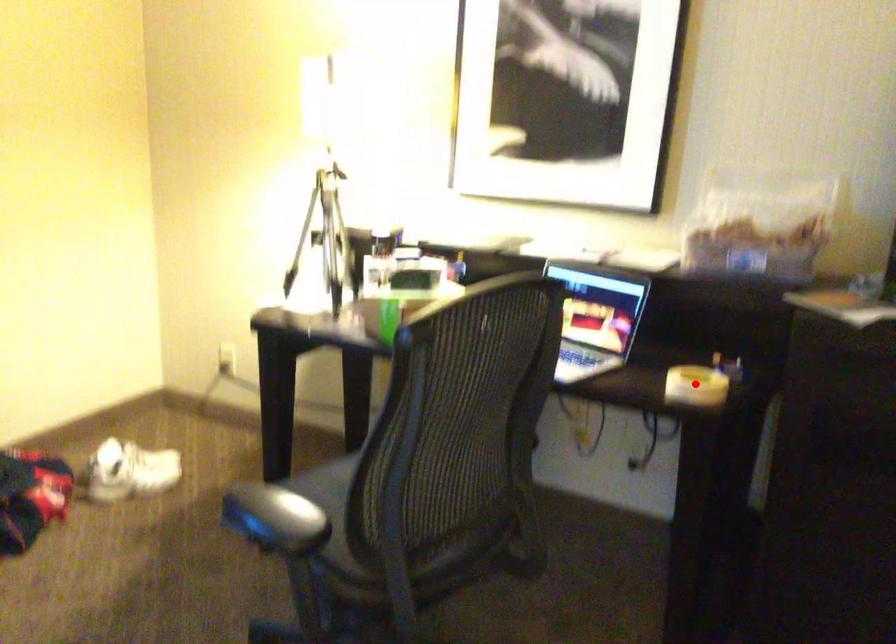
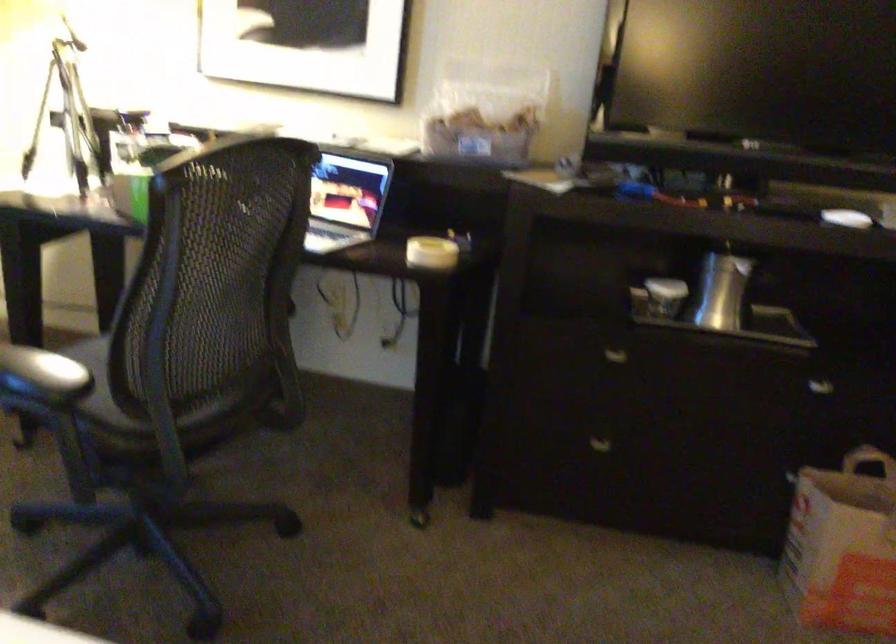
Question: I am providing you with two images of the same scene from different viewpoints. Image1 has a red point marked. In image2, the corresponding 3D location appears at what relative position? Reply with the corresponding letter.

Choices:
 (A) Closer
 (B) Farther

Answer: (B)